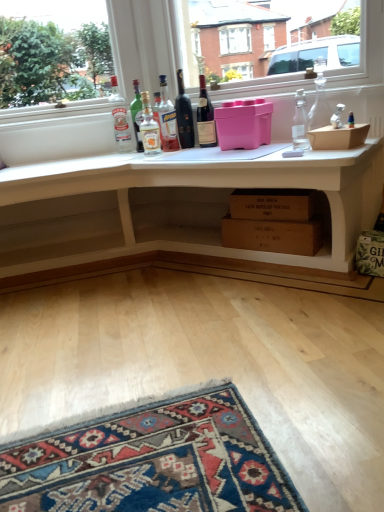
What are the coordinates of `free location in front of dark glass wine bottle at center, marked as the 4th bottle in a right-to-left arrangement` in the screenshot? It's located at (186, 149).